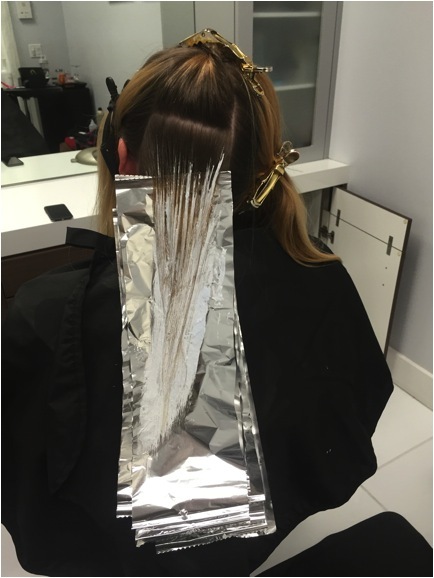
This screenshot has height=578, width=434. I want to click on glass door, so click(291, 57).